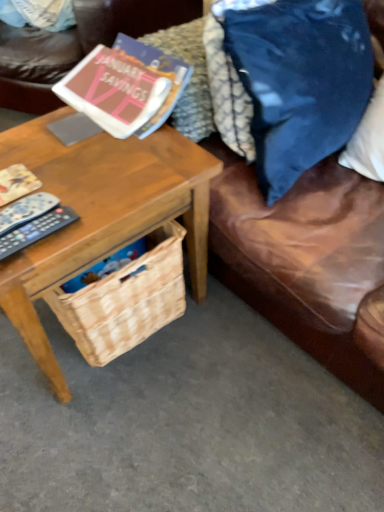
Question: From the image's perspective, is brown leather couch at lower right located above or below matte paper book at upper left?

Choices:
 (A) below
 (B) above

Answer: (A)

Question: In terms of height, does brown leather couch at lower right look taller or shorter compared to matte paper book at upper left?

Choices:
 (A) tall
 (B) short

Answer: (A)

Question: Which object is the closest to the brown leather couch at lower right?

Choices:
 (A) blue velvet pillow at upper right
 (B) woodenobject at left
 (C) matte paper book at upper left
 (D) black plastic remote control at left, which is counted as the first remote control, starting from the bottom
 (E) black plastic remote at left, which is the 1th remote control from top to bottom

Answer: (A)

Question: Which object is the closest to the matte paper book at upper left?

Choices:
 (A) black plastic remote at left, the 2th remote control from the bottom
 (B) black plastic remote control at left, which is counted as the first remote control, starting from the bottom
 (C) brown leather couch at lower right
 (D) woodenobject at left
 (E) blue velvet pillow at upper right

Answer: (D)